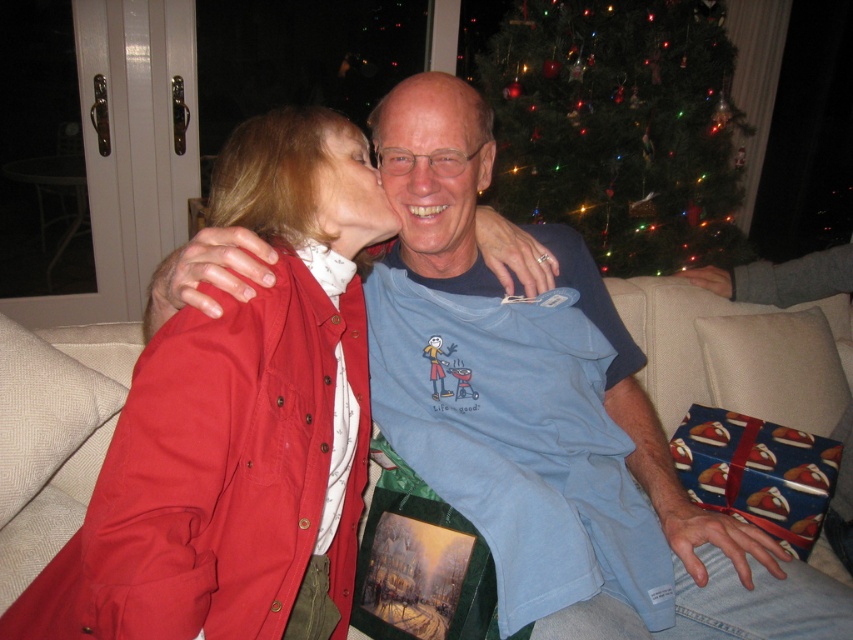
Can you confirm if green textured christmas tree at upper center is positioned to the left of matte blue t-shirt at center?

No, green textured christmas tree at upper center is not to the left of matte blue t-shirt at center.

Which is more to the right, green textured christmas tree at upper center or matte blue t-shirt at center?

From the viewer's perspective, green textured christmas tree at upper center appears more on the right side.

Is point (543, 106) farther from viewer compared to point (457, 177)?

That is True.

At what (x,y) coordinates should I click in order to perform the action: click on green textured christmas tree at upper center. Please return your answer as a coordinate pair (x, y). This screenshot has width=853, height=640. Looking at the image, I should click on (618, 128).

Who is shorter, green textured christmas tree at upper center or matte blue shirt at center?

Standing shorter between the two is matte blue shirt at center.

The width and height of the screenshot is (853, 640). I want to click on green textured christmas tree at upper center, so click(x=618, y=128).

This screenshot has height=640, width=853. Find the location of `green textured christmas tree at upper center`. green textured christmas tree at upper center is located at coordinates (618, 128).

You are a GUI agent. You are given a task and a screenshot of the screen. Output one action in this format:
    pyautogui.click(x=<x>, y=<y>)
    Task: Click on the green textured christmas tree at upper center
    
    Given the screenshot: What is the action you would take?
    pyautogui.click(x=618, y=128)

Does blue cotton t-shirt at center have a greater height compared to matte blue t-shirt at center?

Yes.

Which is more to the left, blue cotton t-shirt at center or matte blue t-shirt at center?

matte blue t-shirt at center

Who is more forward, (815, 630) or (456, 269)?

Point (815, 630) is more forward.

Find the location of a particular element. blue cotton t-shirt at center is located at coordinates (558, 460).